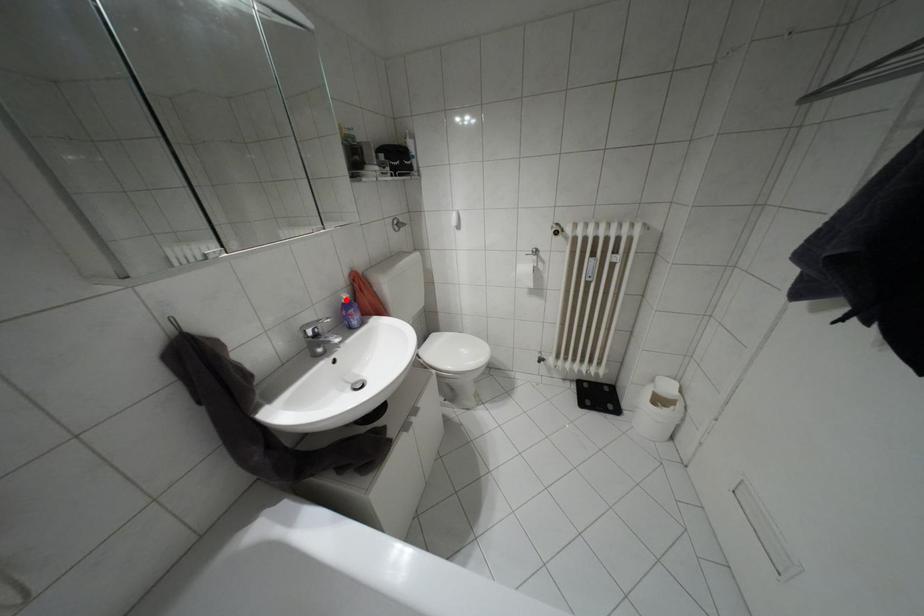
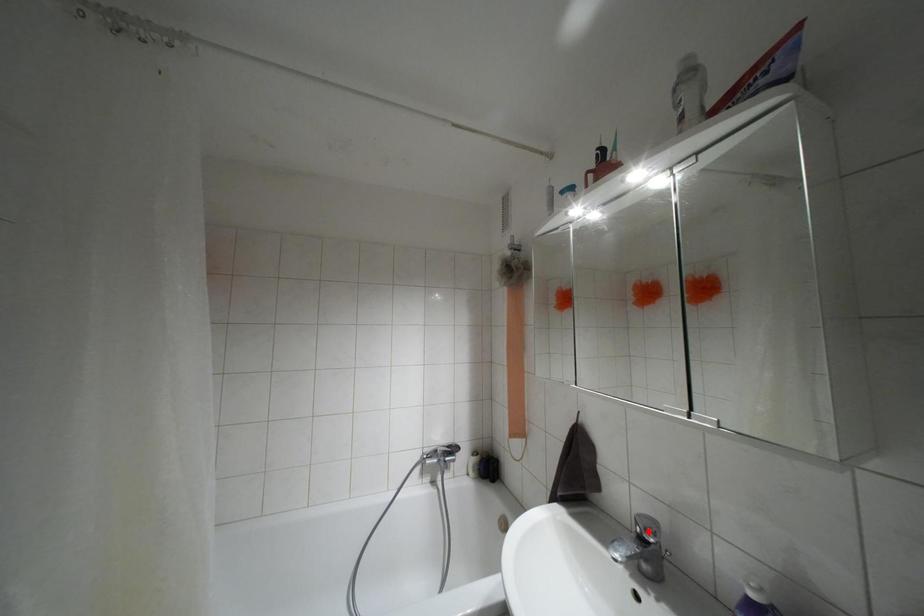
I am providing you with two images of the same scene from different viewpoints. A red point is marked on the first image and another point is marked on the second image. Is the red point in image1 aligned with the point shown in image2?

No